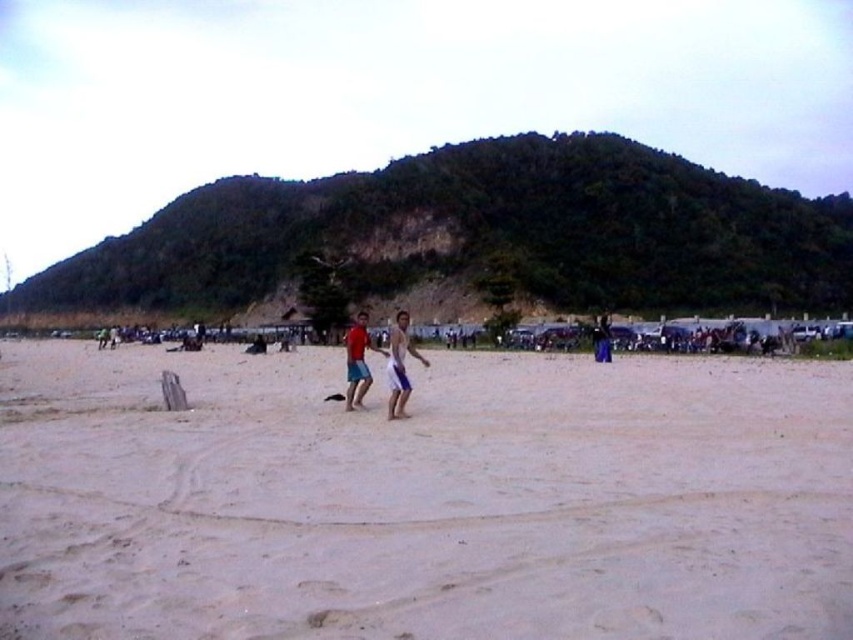
Question: Is light beige sand at center bigger than light blue shorts at center?

Choices:
 (A) yes
 (B) no

Answer: (A)

Question: Estimate the real-world distances between objects in this image. Which object is closer to the matte red shorts at center?

Choices:
 (A) light beige sand at center
 (B) light blue shorts at center

Answer: (B)

Question: Which of the following is the closest to the observer?

Choices:
 (A) light beige sand at center
 (B) light blue shorts at center
 (C) matte red shorts at center

Answer: (A)

Question: Which point is farther from the camera taking this photo?

Choices:
 (A) (383, 349)
 (B) (4, 440)
 (C) (407, 314)

Answer: (C)

Question: Can you confirm if light beige sand at center is wider than light blue shorts at center?

Choices:
 (A) no
 (B) yes

Answer: (B)

Question: From the image, what is the correct spatial relationship of light beige sand at center in relation to light blue shorts at center?

Choices:
 (A) above
 (B) below

Answer: (B)